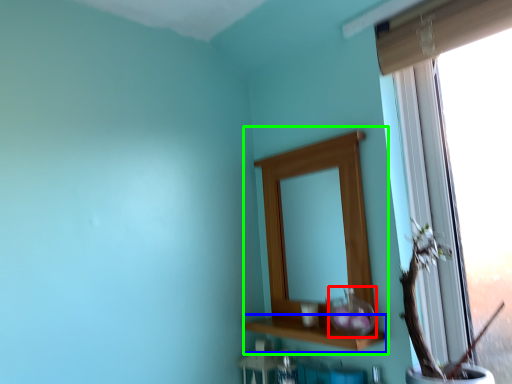
Question: Estimate the real-world distances between objects in this image. Which object is farther from glass vase (highlighted by a red box), window sill (highlighted by a blue box) or medicine cabinet (highlighted by a green box)?

Choices:
 (A) window sill
 (B) medicine cabinet

Answer: (B)